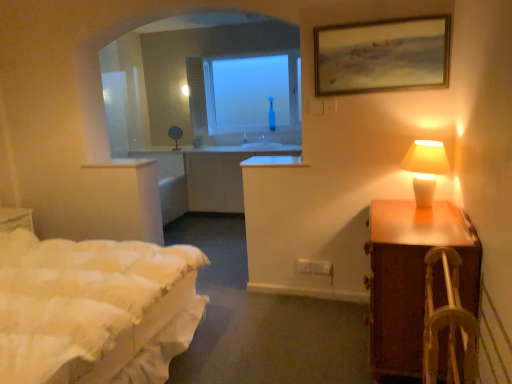
Locate an element on the screen. This screenshot has width=512, height=384. empty space that is ontop of wooden framed painting at upper right (from a real-world perspective) is located at coordinates coord(381,10).